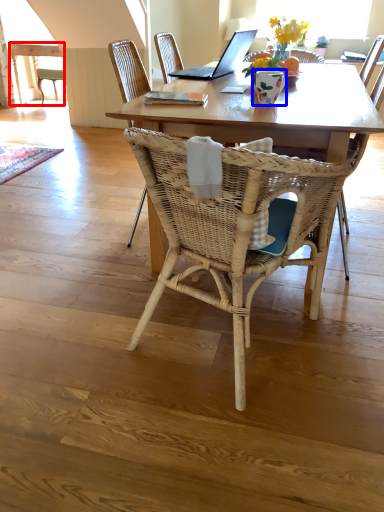
Question: Which object appears farthest to the camera in this image, table (highlighted by a red box) or vase (highlighted by a blue box)?

Choices:
 (A) table
 (B) vase

Answer: (A)